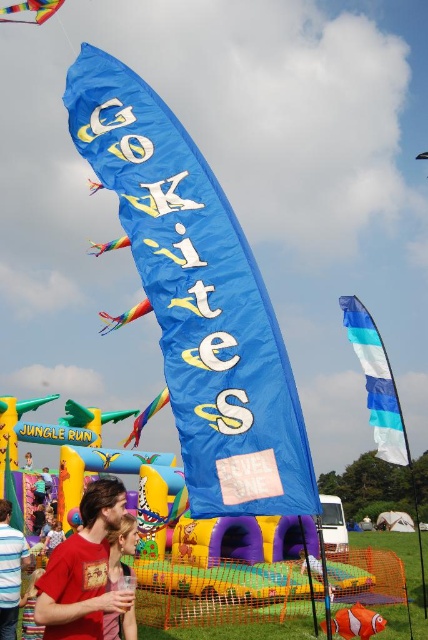
Question: Is matte red shirt at lower left bigger than orange matte clownfish at lower center?

Choices:
 (A) yes
 (B) no

Answer: (A)

Question: Which point is farther to the camera?

Choices:
 (A) (94, 636)
 (B) (187, 378)
 (C) (380, 433)
 (D) (0, 12)

Answer: (D)

Question: Estimate the real-world distances between objects in this image. Which object is closer to the blue fabric kite at center?

Choices:
 (A) matte red shirt at lower left
 (B) red t-shirt at center
 (C) red shirt at lower left

Answer: (B)

Question: Is the position of blue fabric kite at center more distant than that of red t-shirt at center?

Choices:
 (A) no
 (B) yes

Answer: (B)

Question: Which is farther from the multicolored fabric kite at upper left?

Choices:
 (A) orange matte clownfish at lower center
 (B) matte red shirt at lower left
 (C) red t-shirt at center

Answer: (A)

Question: Considering the relative positions of blue fabric sail at center and multicolored fabric kite at upper left in the image provided, where is blue fabric sail at center located with respect to multicolored fabric kite at upper left?

Choices:
 (A) right
 (B) left

Answer: (A)